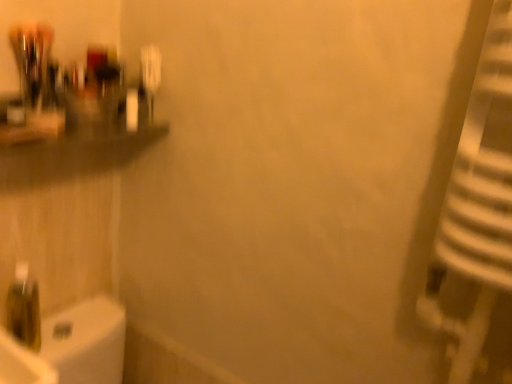
This screenshot has width=512, height=384. What are the coordinates of `translucent plastic bottle at lower left` in the screenshot? It's located at (24, 309).

What do you see at coordinates (24, 309) in the screenshot? This screenshot has height=384, width=512. I see `translucent plastic bottle at lower left` at bounding box center [24, 309].

What is the approximate height of translucent plastic bottle at lower left?

The height of translucent plastic bottle at lower left is 22.54 centimeters.

Where is `translucent plastic bottle at lower left`? translucent plastic bottle at lower left is located at coordinates (24, 309).